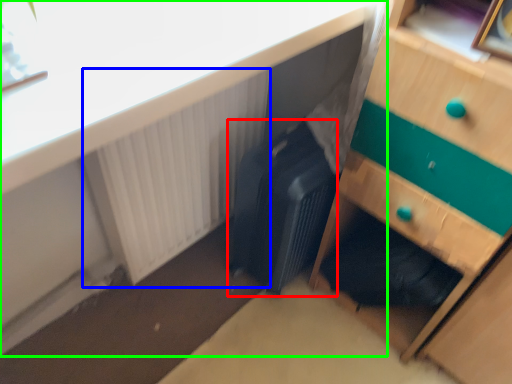
Question: Considering the real-world distances, which object is closest to luggage (highlighted by a red box)? radiator (highlighted by a blue box) or desk (highlighted by a green box).

Choices:
 (A) radiator
 (B) desk

Answer: (A)